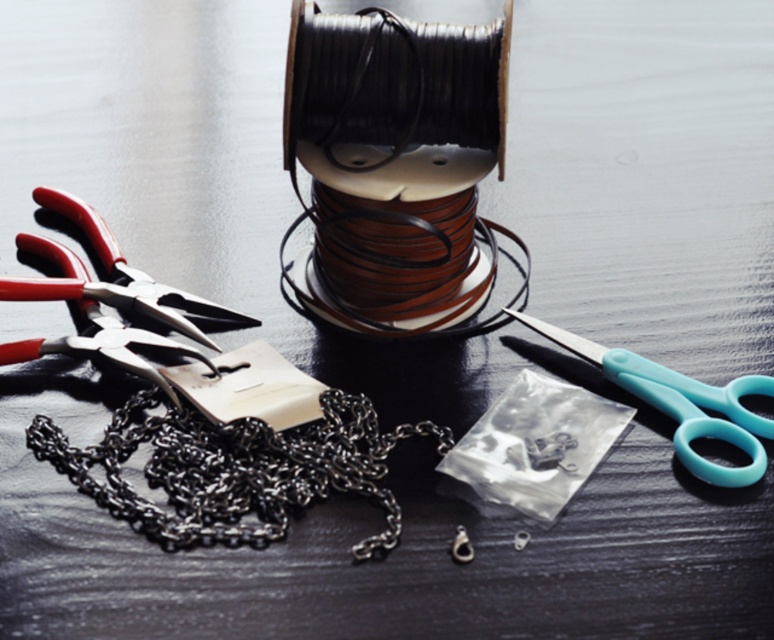
Question: Which object is closer to the camera taking this photo?

Choices:
 (A) teal plastic scissors at right
 (B) black metallic chain at center
 (C) matte metal pliers at left

Answer: (B)

Question: In this image, where is teal plastic scissors at right located relative to matte metal pliers at left?

Choices:
 (A) below
 (B) above

Answer: (A)

Question: Which of the following is the closest to the observer?

Choices:
 (A) (67, 465)
 (B) (135, 291)

Answer: (A)

Question: Where is black metallic chain at center located in relation to teal plastic scissors at right in the image?

Choices:
 (A) right
 (B) left

Answer: (B)

Question: Among these objects, which one is farthest from the camera?

Choices:
 (A) black metallic chain at center
 (B) matte metal pliers at left

Answer: (B)

Question: Observing the image, what is the correct spatial positioning of teal plastic scissors at right in reference to matte metal pliers at left?

Choices:
 (A) right
 (B) left

Answer: (A)